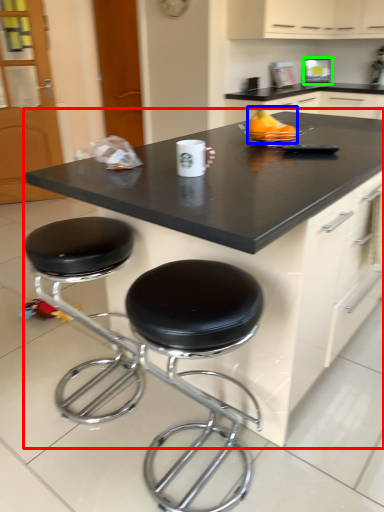
Question: Which is farther away from countertop (highlighted by a red box)? fruit (highlighted by a blue box) or appliance (highlighted by a green box)?

Choices:
 (A) fruit
 (B) appliance

Answer: (B)